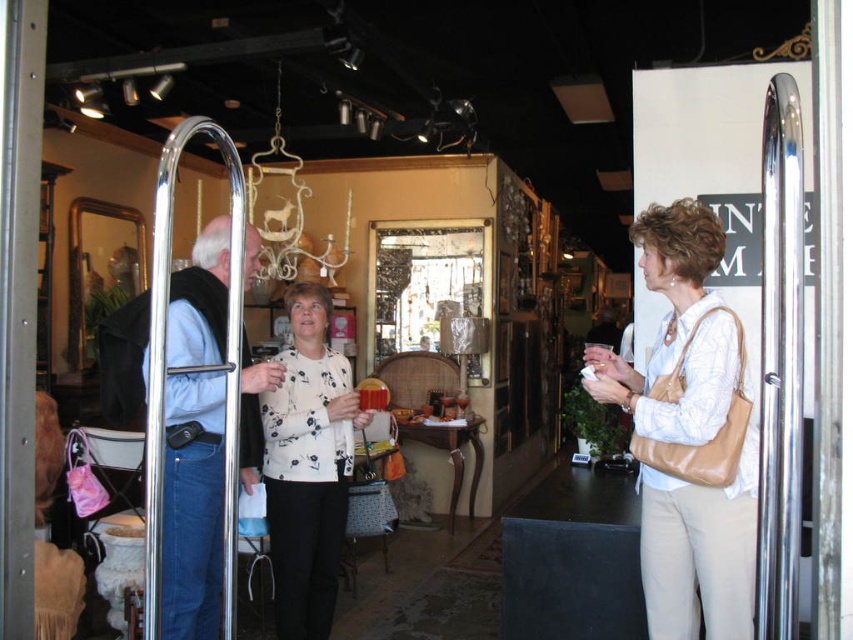
Is point (740, 380) positioned after point (347, 461)?

No, (740, 380) is closer to viewer.

Is beige leather purse at center taller than white floral sweater at center?

No.

Which is behind, point (685, 404) or point (306, 429)?

The point (306, 429) is behind.

At what (x,y) coordinates should I click in order to perform the action: click on beige leather purse at center. Please return your answer as a coordinate pair (x, y). Looking at the image, I should click on (689, 435).

Who is positioned more to the left, white floral sweater at center or polished chrome door at center?

From the viewer's perspective, polished chrome door at center appears more on the left side.

Locate an element on the screen. white floral sweater at center is located at coordinates (308, 467).

Describe the element at coordinates (308, 467) in the screenshot. This screenshot has width=853, height=640. I see `white floral sweater at center` at that location.

Locate an element on the screen. This screenshot has height=640, width=853. white floral sweater at center is located at coordinates (308, 467).

Between beige leather purse at center and polished chrome door at center, which one has more height?

beige leather purse at center

Is point (741, 509) closer to viewer compared to point (236, 250)?

That is False.

This screenshot has height=640, width=853. Find the location of `beige leather purse at center`. beige leather purse at center is located at coordinates (689, 435).